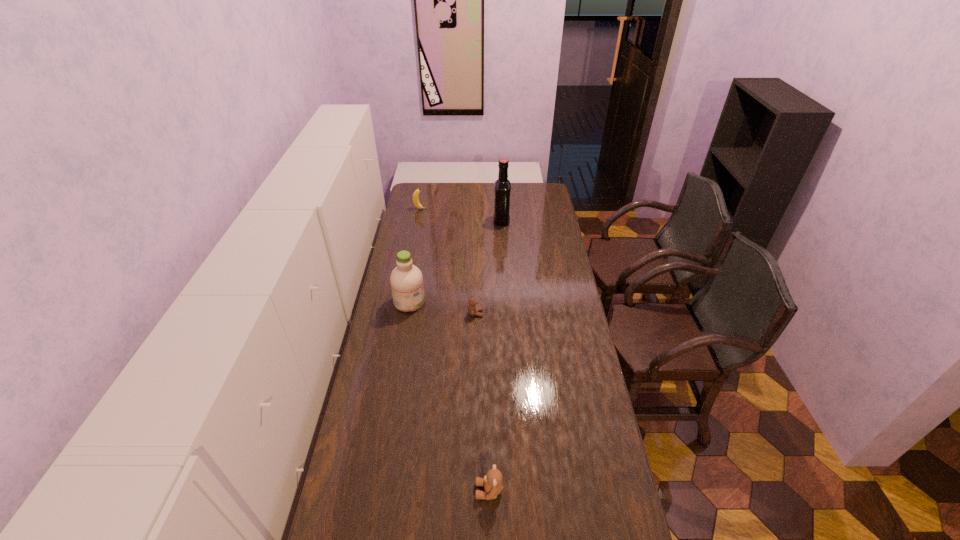
Locate an element on the screen. The height and width of the screenshot is (540, 960). free space located on the front-facing side of the rightmost object is located at coordinates (469, 221).

I want to click on free space located on the front label of the cleansing agent, so click(455, 302).

The height and width of the screenshot is (540, 960). I want to click on vacant space located 0.050m from the stem of the banana, so click(436, 209).

Find the location of a particular element. The height and width of the screenshot is (540, 960). vacant space located on the face of the nearer teddy bear is located at coordinates (432, 491).

Image resolution: width=960 pixels, height=540 pixels. What are the coordinates of `free location located on the face of the nearer teddy bear` in the screenshot? It's located at (396, 491).

Identify the location of vacant area situated 0.180m on the face of the nearer teddy bear. pyautogui.click(x=416, y=491).

You are a GUI agent. You are given a task and a screenshot of the screen. Output one action in this format:
    pyautogui.click(x=<x>, y=<y>)
    Task: Click on the vacant space located 0.240m on the front-facing side of the shorter teddy bear
    This screenshot has width=960, height=540.
    Given the screenshot: What is the action you would take?
    pyautogui.click(x=539, y=313)

Find the location of a particular element. cleansing agent that is at the left edge is located at coordinates (406, 280).

Identify the location of banana that is at the left edge. (416, 202).

In the image, there is a desktop. Where is `vacant space at the left edge`? Image resolution: width=960 pixels, height=540 pixels. vacant space at the left edge is located at coordinates (416, 326).